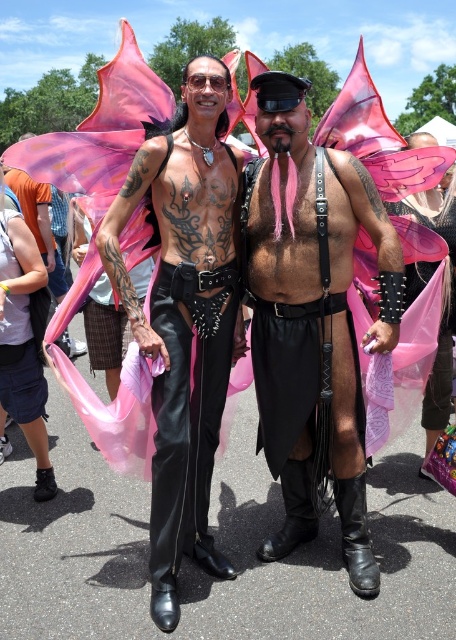
Measure the distance from matte black leather vest at center to matte black leather pants at center.

A distance of 11.08 feet exists between matte black leather vest at center and matte black leather pants at center.

Can you confirm if matte black leather vest at center is wider than matte black leather pants at center?

Indeed, matte black leather vest at center has a greater width compared to matte black leather pants at center.

The width and height of the screenshot is (456, 640). I want to click on matte black leather vest at center, so click(311, 316).

The height and width of the screenshot is (640, 456). What are the coordinates of `matte black leather vest at center` in the screenshot? It's located at (311, 316).

The height and width of the screenshot is (640, 456). What do you see at coordinates (184, 316) in the screenshot? I see `leather pants at center` at bounding box center [184, 316].

Between point (176, 522) and point (52, 250), which one is positioned behind?

Positioned behind is point (52, 250).

Which is in front, point (216, 179) or point (13, 182)?

Point (216, 179)

This screenshot has width=456, height=640. Identify the location of leather pants at center. (184, 316).

Who is positioned more to the right, matte black leather vest at center or leather pants at center?

matte black leather vest at center

Is matte black leather vest at center wider than leather pants at center?

Yes, matte black leather vest at center is wider than leather pants at center.

Does point (295, 436) come behind point (157, 214)?

That is True.

The width and height of the screenshot is (456, 640). I want to click on matte black leather vest at center, so click(311, 316).